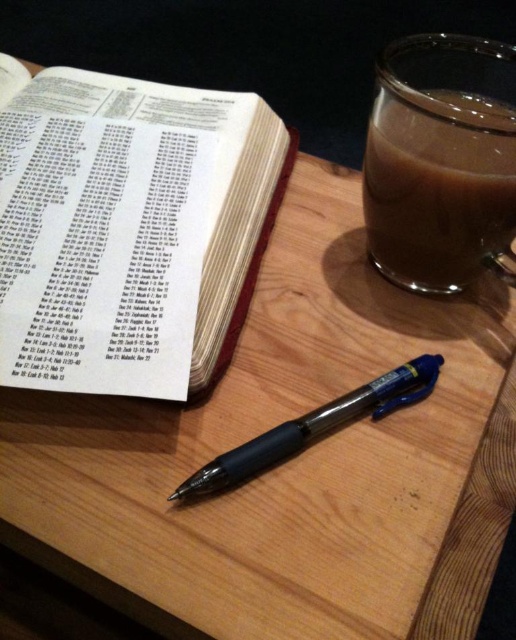
Between brown translucent mug at upper right and black plastic pen at center, which one appears on the right side from the viewer's perspective?

brown translucent mug at upper right is more to the right.

What are the coordinates of `brown translucent mug at upper right` in the screenshot? It's located at (436, 195).

Who is more distant from viewer, [167,131] or [378,211]?

The point [167,131] is more distant.

Consider the image. Measure the distance between white paper book at upper left and brown translucent mug at upper right.

5.31 inches

Is point (270, 161) positioned before point (497, 221)?

No, (270, 161) is further to viewer.

This screenshot has width=516, height=640. I want to click on white paper book at upper left, so pyautogui.click(x=125, y=227).

Measure the distance between white paper book at upper left and black plastic pen at center.

white paper book at upper left is 6.41 inches from black plastic pen at center.

Is point (10, 323) closer to camera compared to point (301, 429)?

No.

Is point (14, 209) closer to viewer compared to point (296, 433)?

No, (14, 209) is behind (296, 433).

Image resolution: width=516 pixels, height=640 pixels. In order to click on white paper book at upper left in this screenshot , I will do `click(125, 227)`.